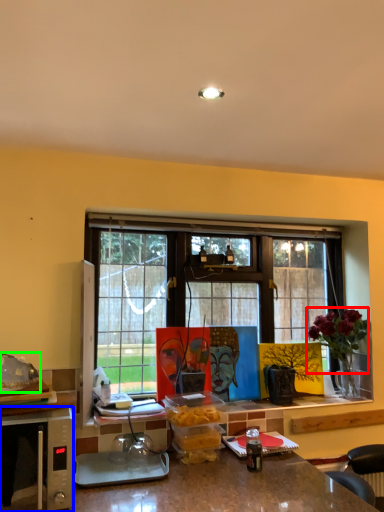
Question: Based on their relative distances, which object is nearer to flower (highlighted by a red box)? Choose from microwave oven (highlighted by a blue box) and food (highlighted by a green box).

Choices:
 (A) microwave oven
 (B) food

Answer: (A)